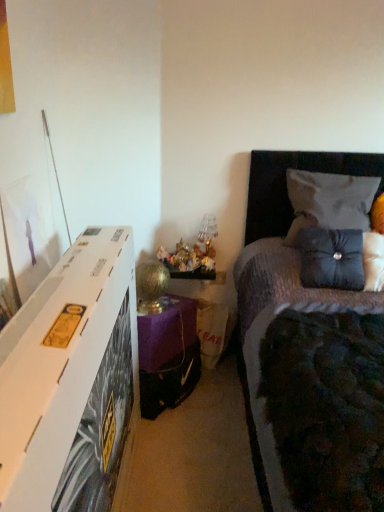
You are a GUI agent. You are given a task and a screenshot of the screen. Output one action in this format:
    pyautogui.click(x=<x>, y=<y>)
    Task: Click on the satin blue pillow at upper right, which ranks as the first pillow in bottom-to-top order
    This screenshot has width=384, height=512.
    Given the screenshot: What is the action you would take?
    pyautogui.click(x=331, y=258)

Is dark grey fabric bed at upper right looking in the opposite direction of satin blue pillow at upper right, which is counted as the 2th pillow, starting from the top?

Correct, dark grey fabric bed at upper right is looking away from satin blue pillow at upper right, which is counted as the 2th pillow, starting from the top.

Would you say dark grey fabric bed at upper right is to the left or to the right of satin blue pillow at upper right, which ranks as the first pillow in bottom-to-top order, in the picture?

In the image, dark grey fabric bed at upper right appears on the right side of satin blue pillow at upper right, which ranks as the first pillow in bottom-to-top order.

Can you confirm if dark grey fabric bed at upper right is taller than satin blue pillow at upper right, which is counted as the 2th pillow, starting from the top?

Yes.

Is point (341, 196) less distant than point (152, 282)?

No, it is behind (152, 282).

Image resolution: width=384 pixels, height=512 pixels. Identify the location of the 1st pillow in front of the gold metallic table lamp at lower center, counting from the anchor's position. (331, 199).

Is velvet gray pillow at upper right, placed as the 1th pillow when sorted from top to bottom, not inside gold metallic table lamp at lower center?

Yes, velvet gray pillow at upper right, placed as the 1th pillow when sorted from top to bottom, is not within gold metallic table lamp at lower center.

Between purple fabric nightstand at lower center and dark grey fabric bed at upper right, which one has larger width?

dark grey fabric bed at upper right.

Is purple fabric nightstand at lower center aimed at dark grey fabric bed at upper right?

Yes, purple fabric nightstand at lower center is facing dark grey fabric bed at upper right.

Is point (151, 387) closer or farther from the camera than point (249, 189)?

Clearly, point (151, 387) is closer to the camera than point (249, 189).

Looking at their sizes, would you say dark grey fabric bed at upper right is wider or thinner than velvet gray pillow at upper right, placed as the 1th pillow when sorted from top to bottom?

dark grey fabric bed at upper right is wider than velvet gray pillow at upper right, placed as the 1th pillow when sorted from top to bottom.

Is dark grey fabric bed at upper right next to velvet gray pillow at upper right, placed as the 1th pillow when sorted from top to bottom, and touching it?

No, dark grey fabric bed at upper right is not next to velvet gray pillow at upper right, placed as the 1th pillow when sorted from top to bottom.

The width and height of the screenshot is (384, 512). I want to click on pillow on the right of the dark grey fabric bed at upper right, so click(x=331, y=199).

Could you tell me if gold metallic table lamp at lower center is facing velvet gray pillow at upper right, the second pillow positioned from the bottom?

No, gold metallic table lamp at lower center is not turned towards velvet gray pillow at upper right, the second pillow positioned from the bottom.

From the gold metallic table lamp at lower center, count 1st pillows forward and point to it. Please provide its 2D coordinates.

[(331, 199)]

Which of these two, gold metallic table lamp at lower center or velvet gray pillow at upper right, the second pillow positioned from the bottom, is smaller?

Smaller between the two is gold metallic table lamp at lower center.

Is point (148, 311) closer or farther from the camera than point (340, 201)?

Point (148, 311).

Can you confirm if velvet gray pillow at upper right, placed as the 1th pillow when sorted from top to bottom, is shorter than dark grey fabric bed at upper right?

Yes.

Is velvet gray pillow at upper right, placed as the 1th pillow when sorted from top to bottom, bigger or smaller than dark grey fabric bed at upper right?

Clearly, velvet gray pillow at upper right, placed as the 1th pillow when sorted from top to bottom, is smaller in size than dark grey fabric bed at upper right.

Considering the relative positions of velvet gray pillow at upper right, the second pillow positioned from the bottom, and dark grey fabric bed at upper right in the image provided, is velvet gray pillow at upper right, the second pillow positioned from the bottom, to the right of dark grey fabric bed at upper right from the viewer's perspective?

Correct, you'll find velvet gray pillow at upper right, the second pillow positioned from the bottom, to the right of dark grey fabric bed at upper right.

Which is correct: velvet gray pillow at upper right, the second pillow positioned from the bottom, is inside dark grey fabric bed at upper right, or outside of it?

velvet gray pillow at upper right, the second pillow positioned from the bottom, is contained in dark grey fabric bed at upper right.

Can you tell me how much purple fabric nightstand at lower center and gold metallic table lamp at lower center differ in facing direction?

55.9 degrees.

Would you say purple fabric nightstand at lower center is to the left or to the right of gold metallic table lamp at lower center in the picture?

Clearly, purple fabric nightstand at lower center is on the right of gold metallic table lamp at lower center in the image.

In terms of height, does purple fabric nightstand at lower center look taller or shorter compared to gold metallic table lamp at lower center?

purple fabric nightstand at lower center is shorter than gold metallic table lamp at lower center.

Is gold metallic table lamp at lower center inside purple fabric nightstand at lower center?

No, gold metallic table lamp at lower center is not a part of purple fabric nightstand at lower center.

Find the location of a particular element. bed located underneath the satin blue pillow at upper right, which is counted as the 2th pillow, starting from the top (from a real-world perspective) is located at coordinates (286, 185).

Identify the location of table lamp that is on the left side of velvet gray pillow at upper right, the second pillow positioned from the bottom. This screenshot has width=384, height=512. (151, 286).

Considering their positions, is purple fabric nightstand at lower center positioned closer to velvet gray pillow at upper right, the second pillow positioned from the bottom, than satin blue pillow at upper right, which ranks as the first pillow in bottom-to-top order?

The object closer to velvet gray pillow at upper right, the second pillow positioned from the bottom, is satin blue pillow at upper right, which ranks as the first pillow in bottom-to-top order.

Estimate the real-world distances between objects in this image. Which object is further from satin blue pillow at upper right, which ranks as the first pillow in bottom-to-top order, dark grey fabric bed at upper right or gold metallic table lamp at lower center?

gold metallic table lamp at lower center lies further to satin blue pillow at upper right, which ranks as the first pillow in bottom-to-top order, than the other object.

From the image, which object appears to be farther from velvet gray pillow at upper right, placed as the 1th pillow when sorted from top to bottom, purple fabric nightstand at lower center or dark grey fabric bed at upper right?

purple fabric nightstand at lower center.

Looking at the image, which one is located further to gold metallic table lamp at lower center, dark grey fabric bed at upper right or velvet gray pillow at upper right, placed as the 1th pillow when sorted from top to bottom?

Based on the image, velvet gray pillow at upper right, placed as the 1th pillow when sorted from top to bottom, appears to be further to gold metallic table lamp at lower center.

Based on their spatial positions, is satin blue pillow at upper right, which is counted as the 2th pillow, starting from the top, or dark grey fabric bed at upper right further from gold metallic table lamp at lower center?

satin blue pillow at upper right, which is counted as the 2th pillow, starting from the top, is positioned further to the anchor gold metallic table lamp at lower center.

Which object lies nearer to the anchor point purple fabric nightstand at lower center, satin blue pillow at upper right, which is counted as the 2th pillow, starting from the top, or gold metallic table lamp at lower center?

gold metallic table lamp at lower center is closer to purple fabric nightstand at lower center.

Considering their positions, is gold metallic table lamp at lower center positioned further to dark grey fabric bed at upper right than purple fabric nightstand at lower center?

The object further to dark grey fabric bed at upper right is gold metallic table lamp at lower center.

From the picture: Looking at the image, which one is located closer to dark grey fabric bed at upper right, gold metallic table lamp at lower center or satin blue pillow at upper right, which is counted as the 2th pillow, starting from the top?

Based on the image, satin blue pillow at upper right, which is counted as the 2th pillow, starting from the top, appears to be nearer to dark grey fabric bed at upper right.

I want to click on nightstand between dark grey fabric bed at upper right and velvet gray pillow at upper right, placed as the 1th pillow when sorted from top to bottom, from front to back, so click(x=168, y=356).

Locate an element on the screen. This screenshot has height=512, width=384. nightstand between dark grey fabric bed at upper right and gold metallic table lamp at lower center in the front-back direction is located at coordinates (168, 356).

The width and height of the screenshot is (384, 512). Find the location of `pillow between dark grey fabric bed at upper right and velvet gray pillow at upper right, the second pillow positioned from the bottom, from front to back`. pillow between dark grey fabric bed at upper right and velvet gray pillow at upper right, the second pillow positioned from the bottom, from front to back is located at coordinates (331, 258).

Where is `pillow between velvet gray pillow at upper right, placed as the 1th pillow when sorted from top to bottom, and purple fabric nightstand at lower center vertically`? The height and width of the screenshot is (512, 384). pillow between velvet gray pillow at upper right, placed as the 1th pillow when sorted from top to bottom, and purple fabric nightstand at lower center vertically is located at coordinates (331, 258).